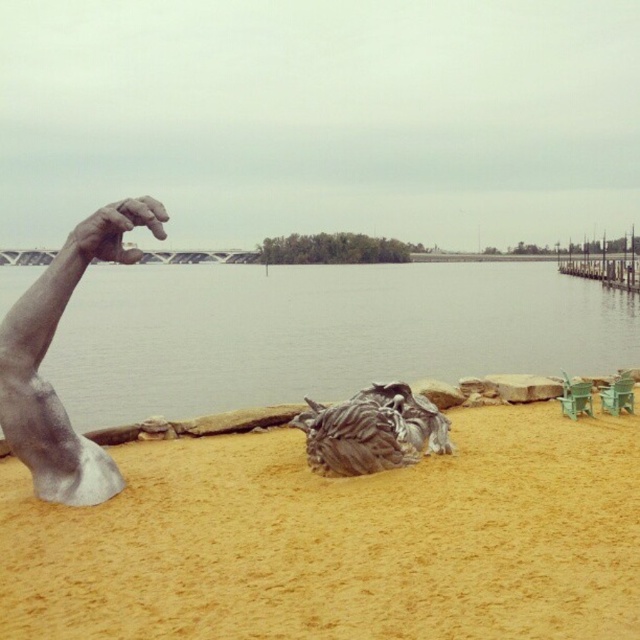
You are a photographer standing at the edge of the beach. You want to capture both the silver metallic arm at left and the rough textured rock at center in a single shot. Based on their sizes, which object will appear larger in the photo?

The silver metallic arm at left is much taller than the rough textured rock at center, so it will appear larger in the photo.